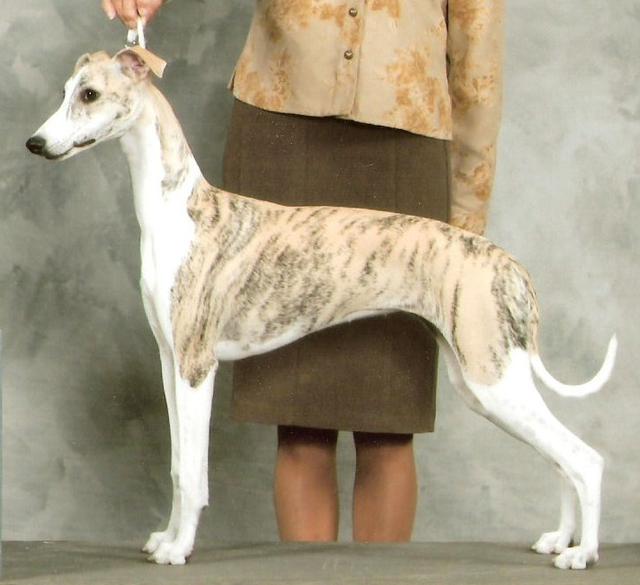
This screenshot has width=640, height=585. What are the coordinates of `white fur` in the screenshot? It's located at (164, 238), (186, 439), (502, 402), (575, 390), (468, 395), (169, 388), (54, 132).